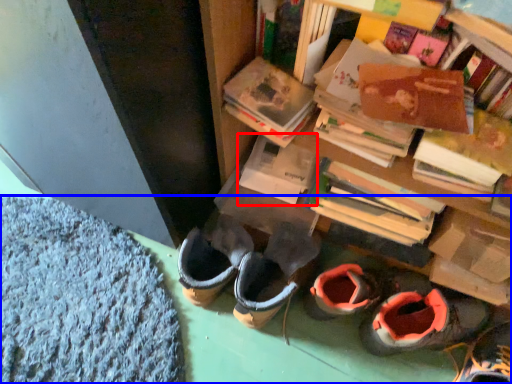
Question: Among these objects, which one is farthest to the camera, paperback book (highlighted by a red box) or carpets (highlighted by a blue box)?

Choices:
 (A) paperback book
 (B) carpets

Answer: (A)